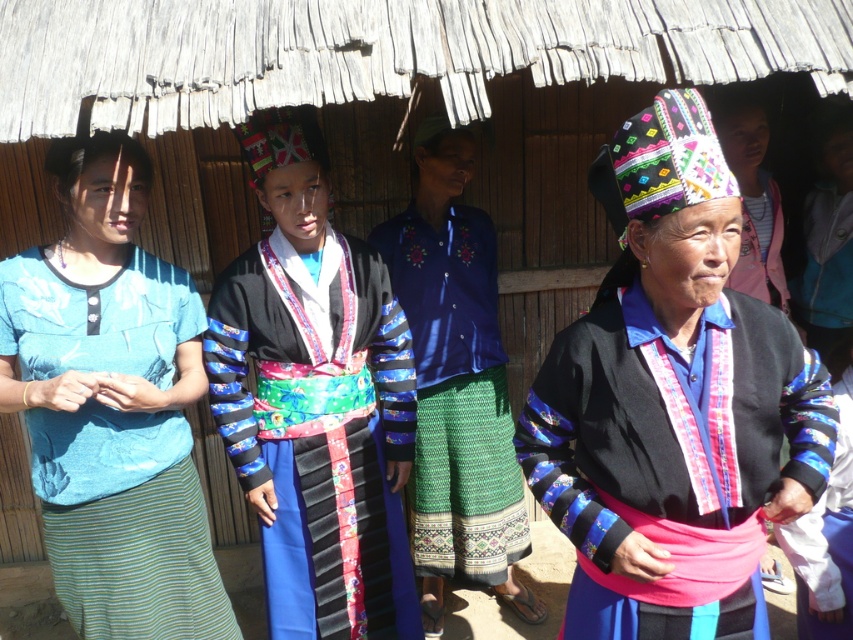
You are organizing a cultural event and need to decide which outfit to display first. The blue fabric shirt at left and the matte black dress at center are both candidates. Based on their physical dimensions, which one is narrower and thus easier to fit into a narrow display case?

The blue fabric shirt at left is thinner than the matte black dress at center, so it is narrower and easier to fit into a narrow display case.

You are a photographer standing in front of the traditional wooden structure with a thatched roof. You want to take a photo of the matte black jacket at center and the blue fabric shirt at left. If your camera has a maximum focus range of 3 feet, will both subjects be in focus?

The matte black jacket at center and blue fabric shirt at left are 3.68 feet apart. Since the distance between them exceeds the camera maximum focus range of 3 feet, they might not both be in focus.

Based on the photo, you are standing at the origin point in the image. The image has a coordinate system where the bottom left corner is the origin. You want to find the matte black dress at center. In which direction should you look to locate it?

The matte black dress at center is located at coordinates point (315, 400). Since the origin is at the bottom left corner, the x coordinate increases to the right and the y coordinate increases upward. Therefore, to locate the matte black dress at center, you should look to the right and slightly upward from the origin.